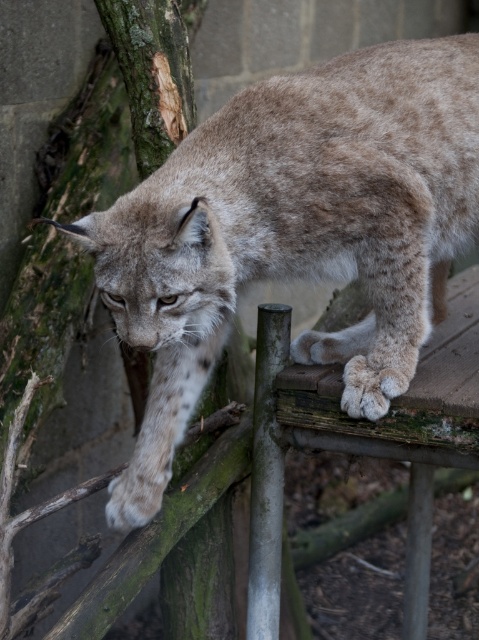
Between fuzzy brown fur at upper center and green rough bark at left, which one has less height?

With less height is fuzzy brown fur at upper center.

Does fuzzy brown fur at upper center have a lesser height compared to green rough bark at left?

Correct, fuzzy brown fur at upper center is not as tall as green rough bark at left.

What do you see at coordinates (294, 230) in the screenshot?
I see `fuzzy brown fur at upper center` at bounding box center [294, 230].

Locate an element on the screen. This screenshot has width=479, height=640. fuzzy brown fur at upper center is located at coordinates click(x=294, y=230).